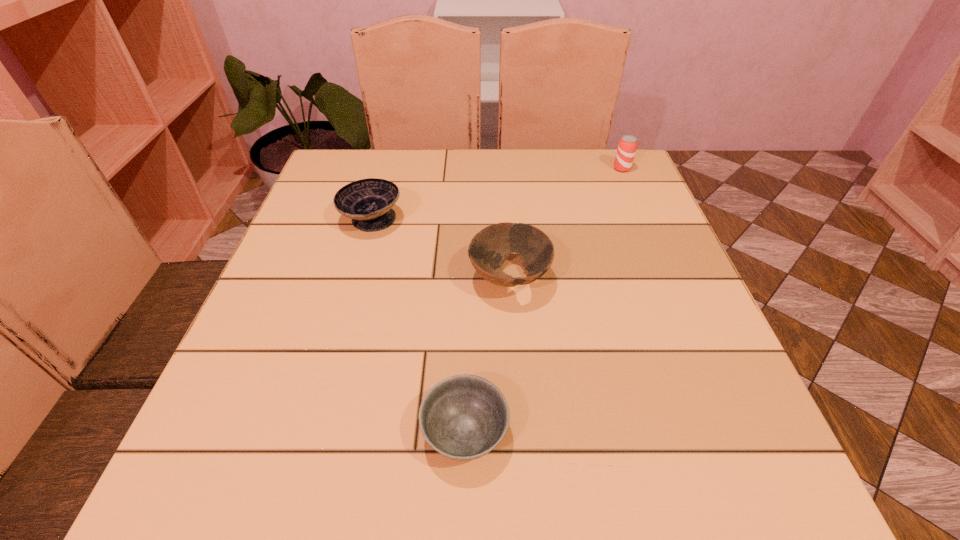
At what (x,y) coordinates should I click in order to perform the action: click on vacant position located 0.330m on the right of the shortest bowl. Please return your answer as a coordinate pair (x, y). The image size is (960, 540). Looking at the image, I should click on (723, 433).

The width and height of the screenshot is (960, 540). I want to click on object that is at the far edge, so click(x=627, y=145).

You are a GUI agent. You are given a task and a screenshot of the screen. Output one action in this format:
    pyautogui.click(x=<x>, y=<y>)
    Task: Click on the object located at the near edge
    The width and height of the screenshot is (960, 540).
    Given the screenshot: What is the action you would take?
    pyautogui.click(x=463, y=417)

Find the location of a particular element. object that is positioned at the left edge is located at coordinates (368, 202).

Find the location of `object at the right edge`. object at the right edge is located at coordinates (627, 145).

Find the location of a particular element. The height and width of the screenshot is (540, 960). object located in the far right corner section of the desktop is located at coordinates (627, 145).

Where is `free space at the far edge`? free space at the far edge is located at coordinates (490, 155).

Locate an element on the screen. free spot at the near edge of the desktop is located at coordinates (516, 483).

Locate an element on the screen. The image size is (960, 540). vacant space at the left edge is located at coordinates (306, 277).

Where is `free space at the right edge`? This screenshot has width=960, height=540. free space at the right edge is located at coordinates pos(588,200).